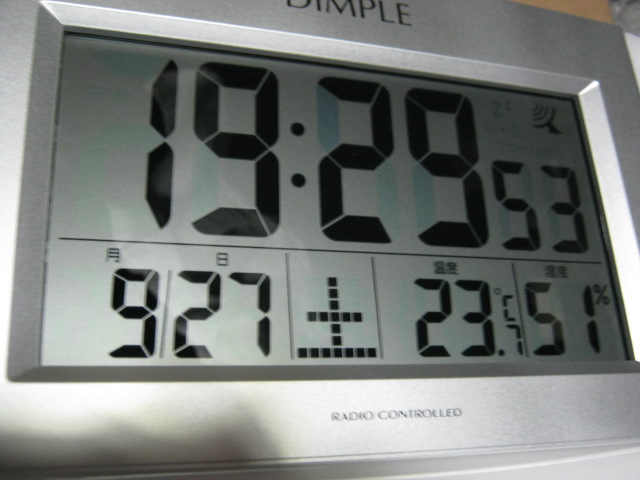
Where is `silver plastic frame`? This screenshot has width=640, height=480. silver plastic frame is located at coordinates (544, 414), (506, 46).